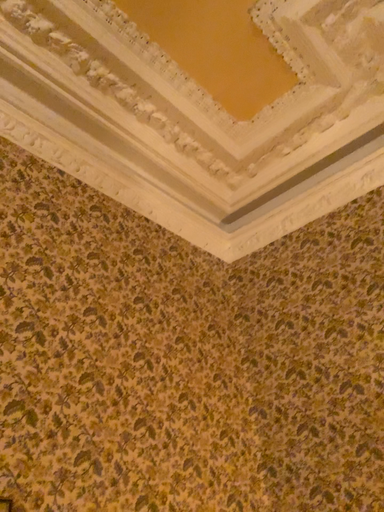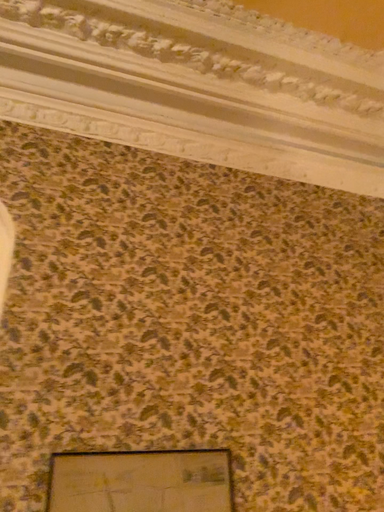
Question: Which way did the camera rotate in the video?

Choices:
 (A) rotated left
 (B) rotated right

Answer: (A)